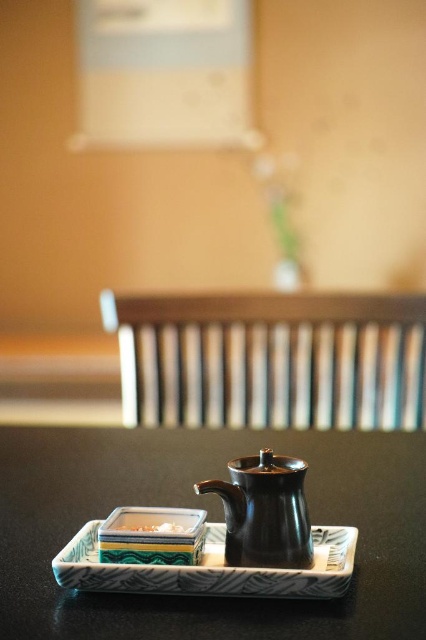
Based on the photo, you are placing a small vase on the matte black tray at center. The vase is 10 inches wide. Will it fit on the tray?

The tray is 17.45 inches wide, so the vase will fit since it is narrower than the tray.

You are setting up a table for a tea ceremony and need to place both the matte black tray at center and the white glossy rectangular plate at center. According to the image, which object should be placed lower to ensure proper setup?

The matte black tray at center should be placed lower than the white glossy rectangular plate at center because the description states that the matte black tray is located below the white glossy rectangular plate.

You are arranging items on a table and need to place a matte black tray at center and a patterned ceramic tray at center. According to the scene, which tray should be placed to the left to match the original arrangement?

The matte black tray at center should be placed to the left of the patterned ceramic tray at center to match the original arrangement.